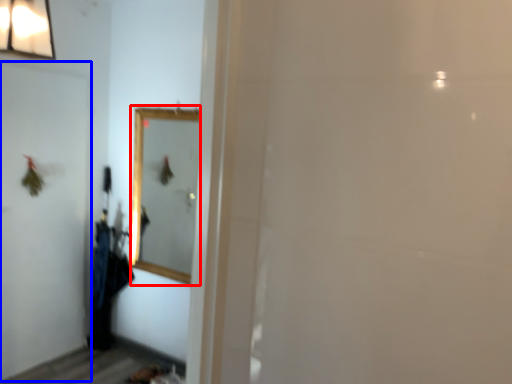
Question: Which object is further to the camera taking this photo, mirror (highlighted by a red box) or screen door (highlighted by a blue box)?

Choices:
 (A) mirror
 (B) screen door

Answer: (A)